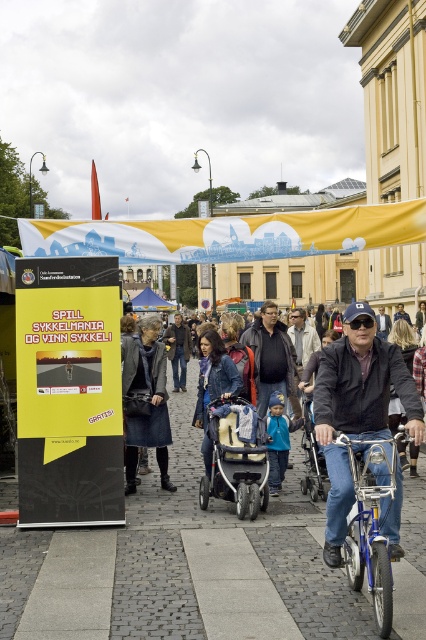
Does silver metallic stroller at center have a greater width compared to dark brown leather jacket at center?

Yes, silver metallic stroller at center is wider than dark brown leather jacket at center.

Can you confirm if silver metallic stroller at center is positioned below dark brown leather jacket at center?

Yes.

The width and height of the screenshot is (426, 640). Describe the element at coordinates (236, 458) in the screenshot. I see `silver metallic stroller at center` at that location.

This screenshot has width=426, height=640. I want to click on silver metallic stroller at center, so click(236, 458).

Describe the element at coordinates (356, 408) in the screenshot. Image resolution: width=426 pixels, height=640 pixels. I see `denim jacket at center` at that location.

Can you confirm if denim jacket at center is positioned below silver metallic stroller at center?

No.

The width and height of the screenshot is (426, 640). Describe the element at coordinates (356, 408) in the screenshot. I see `denim jacket at center` at that location.

The width and height of the screenshot is (426, 640). I want to click on denim jacket at center, so click(x=356, y=408).

Which of these two, leather jacket at center or yellow fabric canopy at center, stands shorter?

yellow fabric canopy at center is shorter.

Locate an element on the screen. Image resolution: width=426 pixels, height=640 pixels. leather jacket at center is located at coordinates (144, 401).

Is point (134, 352) closer to camera compared to point (141, 296)?

Yes, it is in front of point (141, 296).

This screenshot has width=426, height=640. I want to click on leather jacket at center, so click(144, 401).